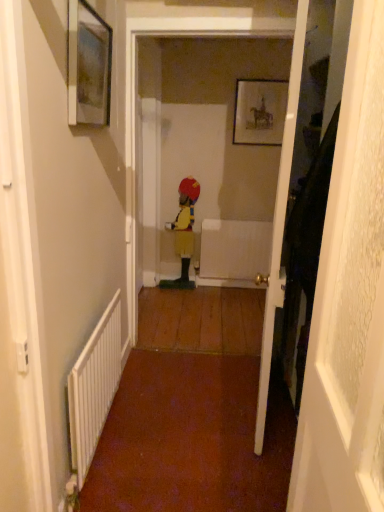
Find the location of a particular element. Image resolution: width=384 pixels, height=512 pixels. wooden door at right, the first door positioned from the back is located at coordinates [x=280, y=224].

What is the approximate height of wooden door at right, the first door positioned from the back?

wooden door at right, the first door positioned from the back, is 6.34 feet tall.

Identify the location of white metallic radiator at lower left. (94, 388).

Identify the location of wooden door at right, which is the 2th door in back-to-front order. (349, 301).

Locate an element on the screen. The image size is (384, 512). wooden door at right, the first door positioned from the back is located at coordinates (280, 224).

From a real-world perspective, which is physically above, wooden door at right, the first door positioned from the back, or matte glass picture frame at upper left, which ranks as the 2th picture frame in right-to-left order?

From a 3D spatial view, matte glass picture frame at upper left, which ranks as the 2th picture frame in right-to-left order, is above.

Considering the sizes of objects wooden door at right, which is the second door from front to back, and matte glass picture frame at upper left, which ranks as the 1th picture frame in left-to-right order, in the image provided, who is wider, wooden door at right, which is the second door from front to back, or matte glass picture frame at upper left, which ranks as the 1th picture frame in left-to-right order,?

With larger width is wooden door at right, which is the second door from front to back.

Does wooden door at right, which is the second door from front to back, appear on the left side of matte glass picture frame at upper left, marked as the first picture frame in a bottom-to-top arrangement?

No, wooden door at right, which is the second door from front to back, is not to the left of matte glass picture frame at upper left, marked as the first picture frame in a bottom-to-top arrangement.

From the image's perspective, would you say wooden door at right, which is the second door from front to back, is shown under matte glass picture frame at upper left, marked as the first picture frame in a bottom-to-top arrangement?

Yes, from the image's perspective, wooden door at right, which is the second door from front to back, is beneath matte glass picture frame at upper left, marked as the first picture frame in a bottom-to-top arrangement.

Considering the sizes of objects white metallic radiator at lower left and yellow fabric figure at center in the image provided, who is bigger, white metallic radiator at lower left or yellow fabric figure at center?

yellow fabric figure at center is bigger.

Consider the image. Can you see white metallic radiator at lower left touching yellow fabric figure at center?

white metallic radiator at lower left and yellow fabric figure at center are not in contact.

Is white metallic radiator at lower left at the right side of yellow fabric figure at center?

Incorrect, white metallic radiator at lower left is not on the right side of yellow fabric figure at center.

Is yellow fabric figure at center aimed at wooden door at right, which is the second door from front to back?

No, yellow fabric figure at center is not aimed at wooden door at right, which is the second door from front to back.

Which is in front, point (190, 287) or point (277, 303)?

The point (277, 303) is more forward.

Can you confirm if yellow fabric figure at center is taller than wooden door at right, which is the second door from front to back?

No, yellow fabric figure at center is not taller than wooden door at right, which is the second door from front to back.

How different are the orientations of yellow fabric figure at center and wooden door at right, the first door positioned from the back, in degrees?

The facing directions of yellow fabric figure at center and wooden door at right, the first door positioned from the back, are 97.7 degrees apart.

Considering the points (338, 436) and (80, 395), which point is behind, point (338, 436) or point (80, 395)?

The point (80, 395) is more distant.

Considering the relative positions of wooden door at right, which is the 2th door in back-to-front order, and white metallic radiator at lower left in the image provided, is wooden door at right, which is the 2th door in back-to-front order, behind white metallic radiator at lower left?

No, it is in front of white metallic radiator at lower left.

Identify the location of radiator below the wooden door at right, which is the 2th door in back-to-front order (from a real-world perspective). (94, 388).

Based on the photo, is wooden door at right, which is the 2th door in back-to-front order, taller than white metallic radiator at lower left?

Yes, wooden door at right, which is the 2th door in back-to-front order, is taller than white metallic radiator at lower left.

Between matte glass picture frame at upper left, the first picture frame in the front-to-back sequence, and yellow fabric figure at center, which one has smaller width?

With smaller width is matte glass picture frame at upper left, the first picture frame in the front-to-back sequence.

What's the angular difference between matte glass picture frame at upper left, the first picture frame in the front-to-back sequence, and yellow fabric figure at center's facing directions?

There is a 90.3-degree angle between the facing directions of matte glass picture frame at upper left, the first picture frame in the front-to-back sequence, and yellow fabric figure at center.

Find the location of `person below the matte glass picture frame at upper left, marked as the second picture frame in a top-to-bottom arrangement (from the image's perspective)`. person below the matte glass picture frame at upper left, marked as the second picture frame in a top-to-bottom arrangement (from the image's perspective) is located at coordinates (184, 232).

Considering the sizes of objects matte glass picture frame at upper left, which ranks as the 2th picture frame in right-to-left order, and yellow fabric figure at center in the image provided, who is smaller, matte glass picture frame at upper left, which ranks as the 2th picture frame in right-to-left order, or yellow fabric figure at center?

matte glass picture frame at upper left, which ranks as the 2th picture frame in right-to-left order, is smaller.

Considering the relative positions of white metallic radiator at lower left and wooden door at right, which is the 2th door in back-to-front order, in the image provided, is white metallic radiator at lower left to the left or to the right of wooden door at right, which is the 2th door in back-to-front order,?

white metallic radiator at lower left is positioned on wooden door at right, which is the 2th door in back-to-front order,'s left side.

From the picture: Is the depth of white metallic radiator at lower left greater than that of wooden door at right, acting as the first door starting from the front?

Yes, white metallic radiator at lower left is further from the viewer.

Identify the location of radiator that is under the wooden door at right, which is the 2th door in back-to-front order (from a real-world perspective). (94, 388).

Is point (183, 198) closer to camera compared to point (241, 94)?

No, (183, 198) is further to viewer.

Is yellow fabric figure at center oriented towards matte black picture frame at upper center, the 1th picture frame in the top-to-bottom sequence?

No, yellow fabric figure at center is not oriented towards matte black picture frame at upper center, the 1th picture frame in the top-to-bottom sequence.

Is yellow fabric figure at center to the left of matte black picture frame at upper center, the second picture frame from the left, from the viewer's perspective?

Yes.

From the image's perspective, is yellow fabric figure at center under matte black picture frame at upper center, the 1th picture frame when ordered from right to left?

Yes, from the image's perspective, yellow fabric figure at center is below matte black picture frame at upper center, the 1th picture frame when ordered from right to left.

The height and width of the screenshot is (512, 384). Identify the location of picture frame that is the 2nd object above the wooden door at right, which is the second door from front to back (from a real-world perspective). (88, 66).

This screenshot has height=512, width=384. Find the location of `person on the right of white metallic radiator at lower left`. person on the right of white metallic radiator at lower left is located at coordinates (184, 232).

Which object lies nearer to the anchor point matte black picture frame at upper center, the 1th picture frame in the top-to-bottom sequence, white metallic radiator at lower left or matte glass picture frame at upper left, marked as the first picture frame in a bottom-to-top arrangement?

The object closer to matte black picture frame at upper center, the 1th picture frame in the top-to-bottom sequence, is matte glass picture frame at upper left, marked as the first picture frame in a bottom-to-top arrangement.

Estimate the real-world distances between objects in this image. Which object is further from wooden door at right, which is the 2th door in back-to-front order, matte glass picture frame at upper left, which ranks as the 1th picture frame in left-to-right order, or white metallic radiator at lower left?

matte glass picture frame at upper left, which ranks as the 1th picture frame in left-to-right order.

Based on the photo, which object lies further to the anchor point wooden door at right, which is the second door from front to back, wooden door at right, which is the 2th door in back-to-front order, or matte black picture frame at upper center, which is the 1th picture frame in back-to-front order?

Among the two, matte black picture frame at upper center, which is the 1th picture frame in back-to-front order, is located further to wooden door at right, which is the second door from front to back.

Which object lies nearer to the anchor point matte black picture frame at upper center, the second picture frame from the left, wooden door at right, which is the 2th door in back-to-front order, or white metallic radiator at lower left?

The object closer to matte black picture frame at upper center, the second picture frame from the left, is white metallic radiator at lower left.

Looking at this image, based on their spatial positions, is white metallic radiator at lower left or matte glass picture frame at upper left, marked as the second picture frame in a top-to-bottom arrangement, closer to wooden door at right, which is the second door from front to back?

Among the two, white metallic radiator at lower left is located nearer to wooden door at right, which is the second door from front to back.

Based on their spatial positions, is matte black picture frame at upper center, the 1th picture frame when ordered from right to left, or wooden door at right, which is the 2th door in back-to-front order, closer to yellow fabric figure at center?

matte black picture frame at upper center, the 1th picture frame when ordered from right to left, is closer to yellow fabric figure at center.

Based on their spatial positions, is matte black picture frame at upper center, which appears as the 2th picture frame when viewed from the front, or matte glass picture frame at upper left, marked as the first picture frame in a bottom-to-top arrangement, closer to white metallic radiator at lower left?

Among the two, matte glass picture frame at upper left, marked as the first picture frame in a bottom-to-top arrangement, is located nearer to white metallic radiator at lower left.

Considering their positions, is wooden door at right, which is the 2th door in back-to-front order, positioned further to wooden door at right, the first door positioned from the back, than matte glass picture frame at upper left, marked as the first picture frame in a bottom-to-top arrangement?

matte glass picture frame at upper left, marked as the first picture frame in a bottom-to-top arrangement.

Where is `radiator between wooden door at right, which is the 2th door in back-to-front order, and yellow fabric figure at center in the front-back direction`? This screenshot has width=384, height=512. radiator between wooden door at right, which is the 2th door in back-to-front order, and yellow fabric figure at center in the front-back direction is located at coordinates (94, 388).

Find the location of a particular element. The height and width of the screenshot is (512, 384). door located between wooden door at right, acting as the first door starting from the front, and white metallic radiator at lower left in the depth direction is located at coordinates (280, 224).

At what (x,y) coordinates should I click in order to perform the action: click on picture frame between matte glass picture frame at upper left, marked as the first picture frame in a bottom-to-top arrangement, and yellow fabric figure at center in the front-back direction. Please return your answer as a coordinate pair (x, y). The width and height of the screenshot is (384, 512). Looking at the image, I should click on (x=259, y=112).

Locate an element on the screen. picture frame located between wooden door at right, which is the 2th door in back-to-front order, and wooden door at right, which is the second door from front to back, in the depth direction is located at coordinates (88, 66).